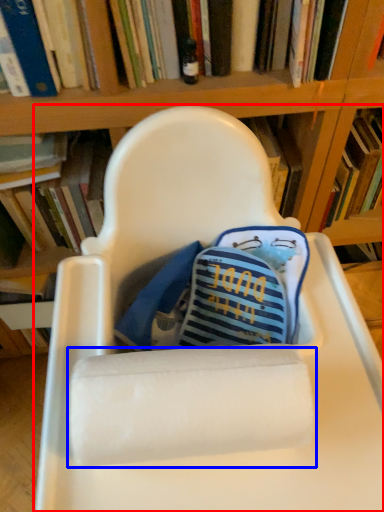
Question: Which of the following is the closest to the observer, chair (highlighted by a red box) or paper towel (highlighted by a blue box)?

Choices:
 (A) chair
 (B) paper towel

Answer: (A)